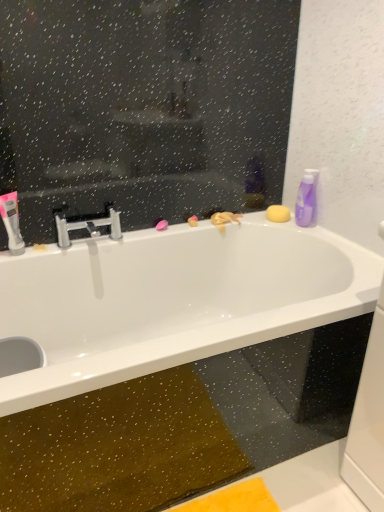
Question: From the image's perspective, is polished chrome faucet at center above white glossy toothpaste at left?

Choices:
 (A) yes
 (B) no

Answer: (A)

Question: From a real-world perspective, is polished chrome faucet at center below white glossy toothpaste at left?

Choices:
 (A) no
 (B) yes

Answer: (B)

Question: Does polished chrome faucet at center have a lesser height compared to white glossy toothpaste at left?

Choices:
 (A) yes
 (B) no

Answer: (A)

Question: Does polished chrome faucet at center have a smaller size compared to white glossy toothpaste at left?

Choices:
 (A) yes
 (B) no

Answer: (B)

Question: Does polished chrome faucet at center turn towards white glossy toothpaste at left?

Choices:
 (A) no
 (B) yes

Answer: (A)

Question: Based on their sizes in the image, would you say white glossy bathtub at upper center is bigger or smaller than polished chrome faucet at center?

Choices:
 (A) small
 (B) big

Answer: (B)

Question: From a real-world perspective, is white glossy bathtub at upper center positioned above or below polished chrome faucet at center?

Choices:
 (A) above
 (B) below

Answer: (B)

Question: Looking at their shapes, would you say white glossy bathtub at upper center is wider or thinner than polished chrome faucet at center?

Choices:
 (A) wide
 (B) thin

Answer: (A)

Question: Relative to polished chrome faucet at center, is white glossy bathtub at upper center in front or behind?

Choices:
 (A) front
 (B) behind

Answer: (A)

Question: Considering the positions of white glossy toothpaste at left and white glossy bathtub at upper center in the image, is white glossy toothpaste at left taller or shorter than white glossy bathtub at upper center?

Choices:
 (A) short
 (B) tall

Answer: (A)

Question: Is white glossy toothpaste at left to the left or to the right of white glossy bathtub at upper center in the image?

Choices:
 (A) right
 (B) left

Answer: (B)

Question: From the image's perspective, is white glossy toothpaste at left located above or below white glossy bathtub at upper center?

Choices:
 (A) above
 (B) below

Answer: (A)

Question: Would you say white glossy toothpaste at left is inside or outside white glossy bathtub at upper center?

Choices:
 (A) outside
 (B) inside

Answer: (A)

Question: Relative to white glossy toothpaste at left, is purple glossy bottle at upper right in front or behind?

Choices:
 (A) behind
 (B) front

Answer: (A)

Question: In the image, is purple glossy bottle at upper right on the left side or the right side of white glossy toothpaste at left?

Choices:
 (A) right
 (B) left

Answer: (A)